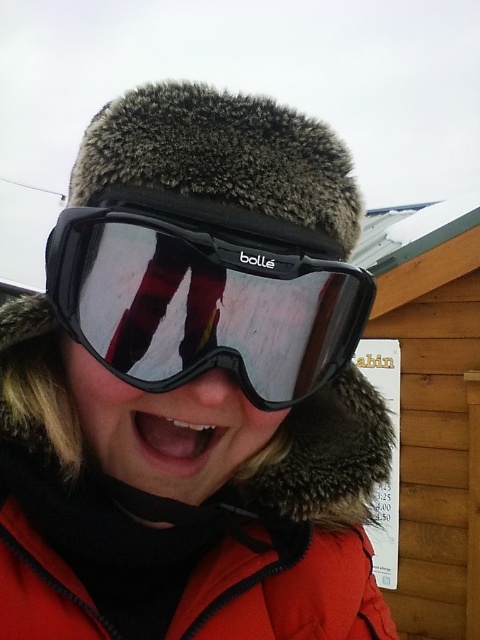
Between orange fleece jacket at center and black matte ski goggles at center, which one appears on the right side from the viewer's perspective?

From the viewer's perspective, orange fleece jacket at center appears more on the right side.

Measure the distance between orange fleece jacket at center and camera.

orange fleece jacket at center is 59.07 centimeters away from camera.

Find the location of a particular element. The image size is (480, 640). orange fleece jacket at center is located at coordinates (192, 528).

Can you confirm if orange fleece jacket at center is positioned to the left of white glossy teeth at center?

In fact, orange fleece jacket at center is to the right of white glossy teeth at center.

Can you confirm if orange fleece jacket at center is taller than white glossy teeth at center?

Yes, orange fleece jacket at center is taller than white glossy teeth at center.

Which is behind, point (325, 490) or point (160, 422)?

Positioned behind is point (325, 490).

This screenshot has width=480, height=640. Identify the location of orange fleece jacket at center. (192, 528).

Between black matte ski goggles at center and white glossy teeth at center, which one has more height?

black matte ski goggles at center

Measure the distance between black matte ski goggles at center and camera.

19.58 inches

Locate an element on the screen. The height and width of the screenshot is (640, 480). black matte ski goggles at center is located at coordinates (203, 301).